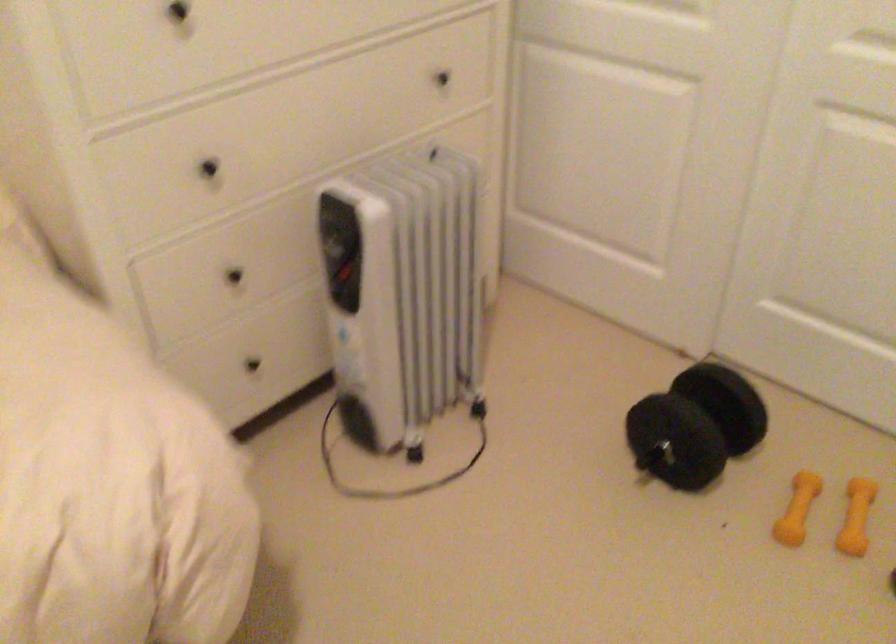
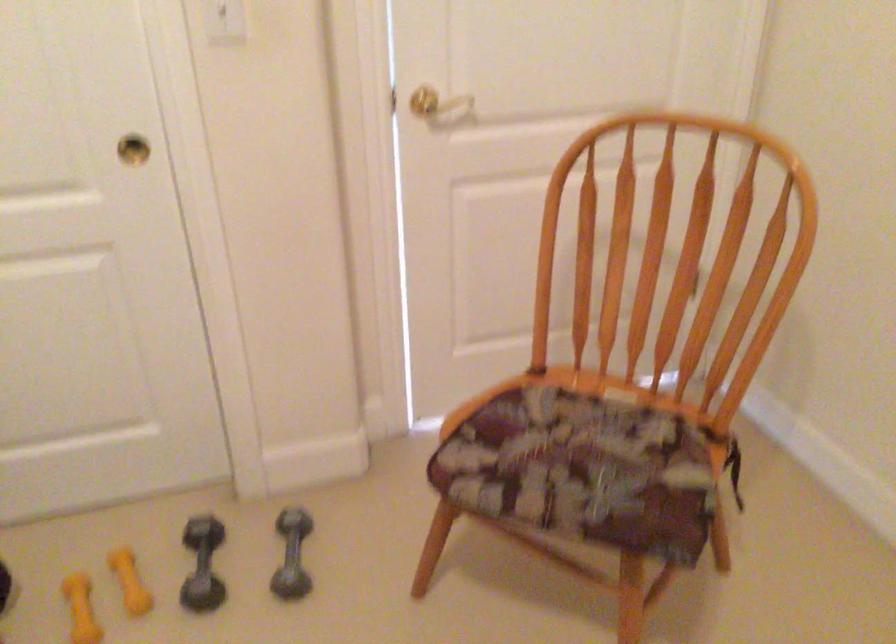
Locate, in the second image, the point that corresponds to point 794,498 in the first image.

(81, 609)